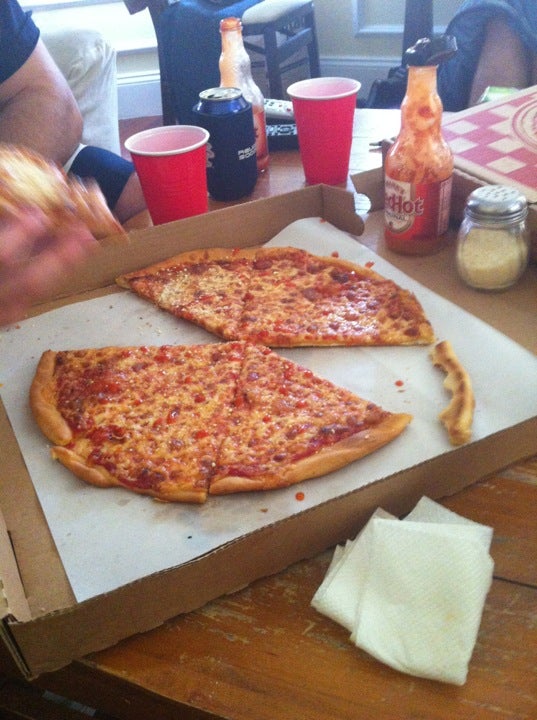
This screenshot has height=720, width=537. Find the location of `cup`. cup is located at coordinates (325, 142).